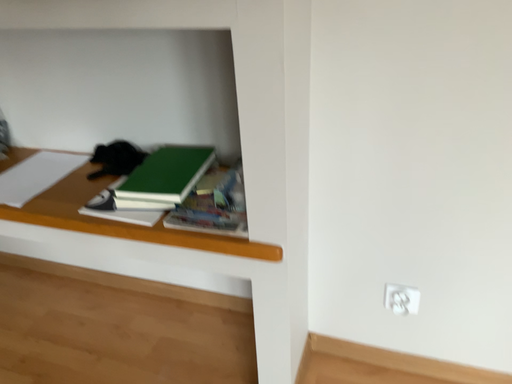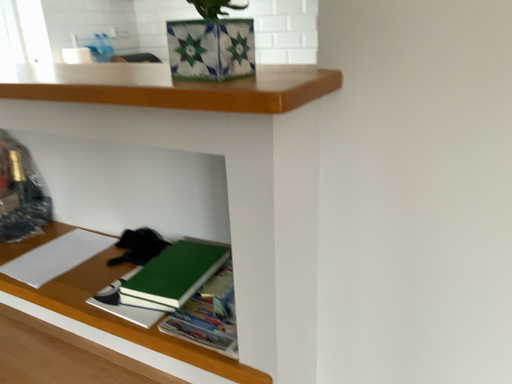
Question: Which way did the camera rotate in the video?

Choices:
 (A) rotated left
 (B) rotated right

Answer: (A)